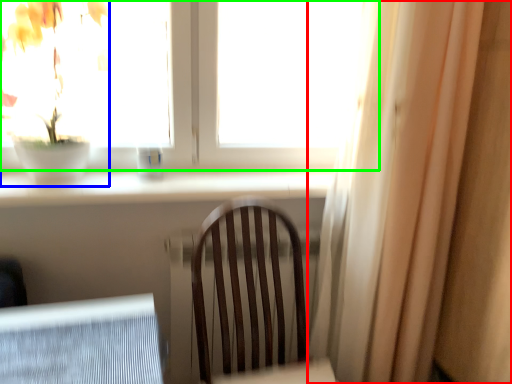
Question: Which is nearer to the curtain (highlighted by a red box)? houseplant (highlighted by a blue box) or window (highlighted by a green box).

Choices:
 (A) houseplant
 (B) window

Answer: (B)